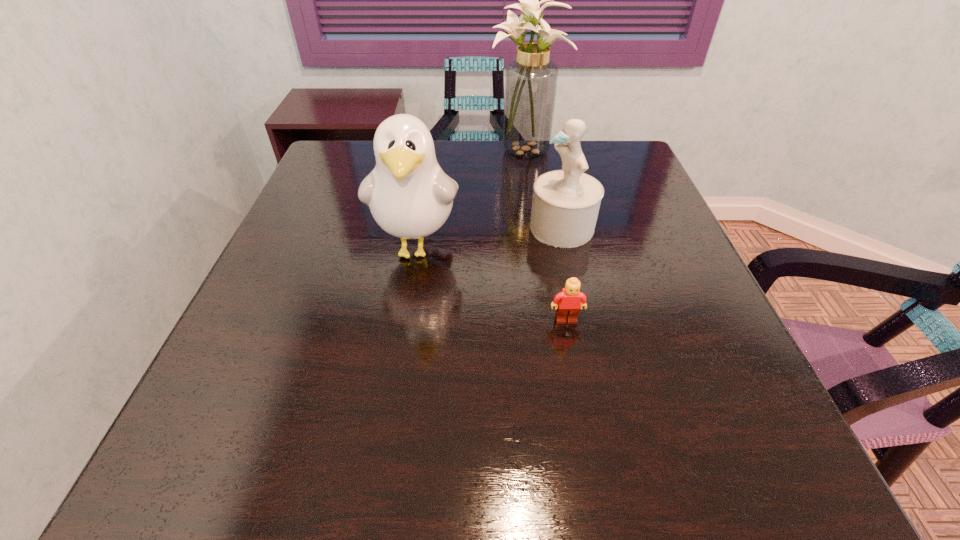
Find the location of a particular element. The image size is (960, 540). free region located 0.120m at the beak of the third tallest object is located at coordinates (480, 227).

The image size is (960, 540). What are the coordinates of `free space located on the face of the nearest object` in the screenshot? It's located at (593, 468).

This screenshot has width=960, height=540. Identify the location of object that is positioned at the far edge. (531, 79).

I want to click on vacant space at the far edge of the desktop, so click(x=442, y=165).

In the image, there is a desktop. Where is `vacant space at the near edge`? Image resolution: width=960 pixels, height=540 pixels. vacant space at the near edge is located at coordinates (286, 451).

What are the coordinates of `vacant position at the left edge of the desktop` in the screenshot? It's located at (244, 363).

The width and height of the screenshot is (960, 540). I want to click on free space at the right edge of the desktop, so pos(729,347).

Find the location of a particular element. vacant space at the far left corner is located at coordinates (340, 156).

Locate an element on the screen. Image resolution: width=960 pixels, height=540 pixels. empty space that is in between the nearest object and the figurine is located at coordinates (564, 274).

Locate an element on the screen. The width and height of the screenshot is (960, 540). vacant point located between the second shortest object and the shortest object is located at coordinates (564, 274).